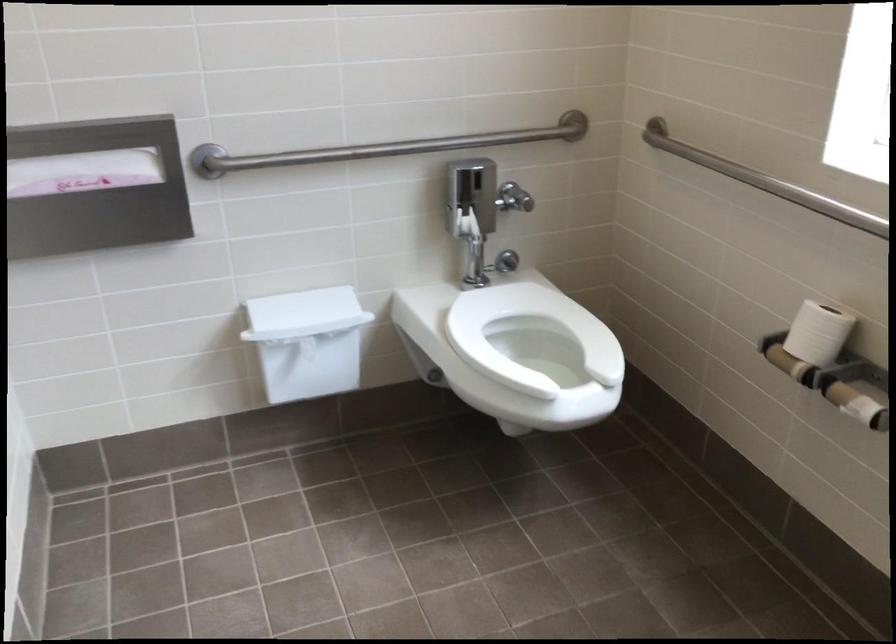
This screenshot has height=644, width=896. Describe the element at coordinates (513, 351) in the screenshot. I see `a white toilet seat` at that location.